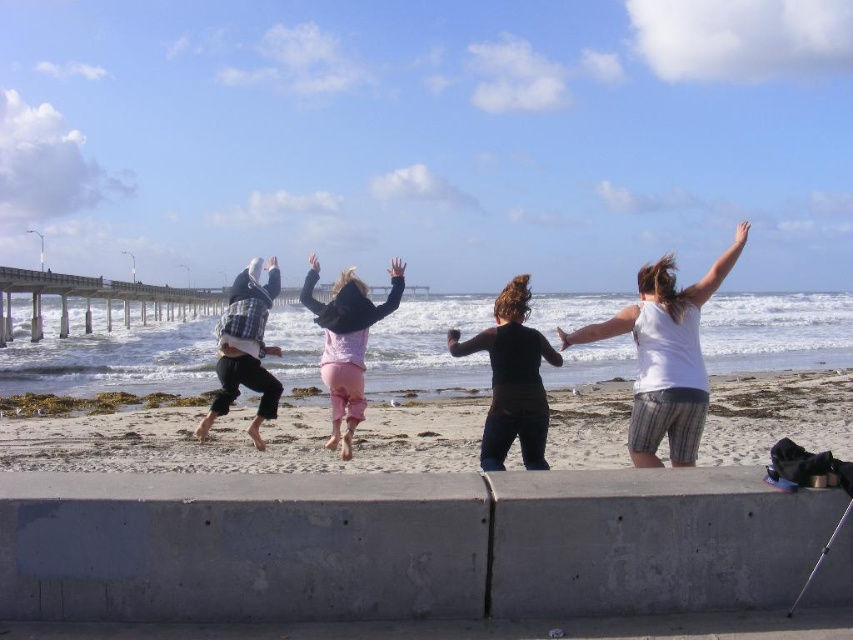
Between beige sand at center and dark brown shirt at center, which one is positioned lower?

beige sand at center

Measure the distance between beige sand at center and dark brown shirt at center.

4.31 meters

Is point (242, 419) positioned after point (535, 461)?

Yes.

Locate an element on the screen. beige sand at center is located at coordinates click(247, 440).

Between point (294, 552) and point (294, 468), which one is positioned in front?

Point (294, 552)

Is the position of concrete ledge at lower center less distant than that of beige sand at center?

Yes, it is in front of beige sand at center.

Who is more distant from viewer, (x=142, y=538) or (x=13, y=432)?

The point (x=13, y=432) is more distant.

This screenshot has width=853, height=640. Find the location of `concrete ledge at lower center`. concrete ledge at lower center is located at coordinates (402, 545).

Who is more forward, (74, 502) or (355, 420)?

Point (74, 502) is more forward.

Is point (184, 513) closer to camera compared to point (345, 301)?

Yes.

Who is more distant from viewer, (21, 544) or (395, 269)?

Positioned behind is point (395, 269).

I want to click on concrete ledge at lower center, so click(402, 545).